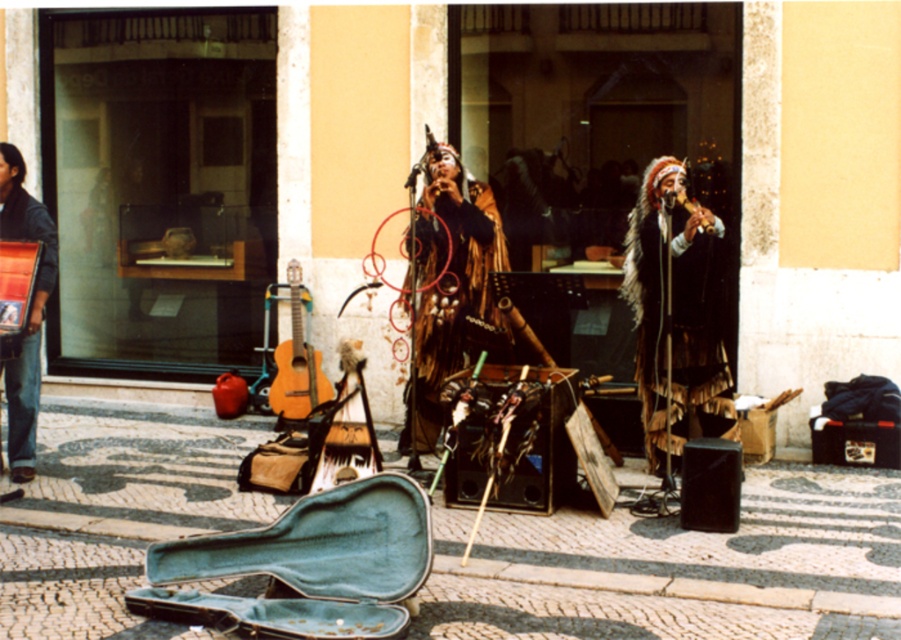
You are a photographer standing at the center of the scene. You want to take a photo that includes both the point at point (479, 321) and point (294, 349). Which point will appear larger in your photo?

Point (479, 321) is closer to the camera than point (294, 349), so it will appear larger in the photo.